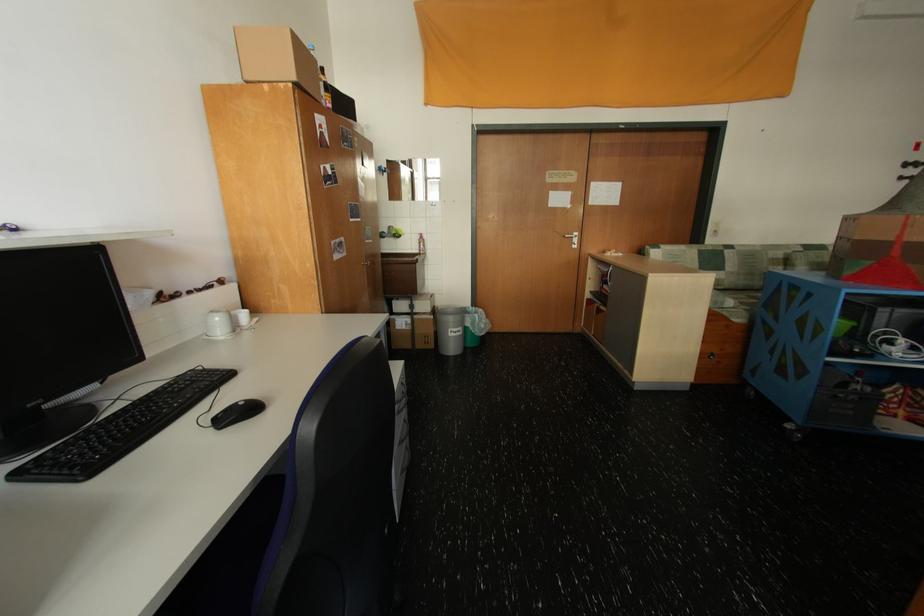
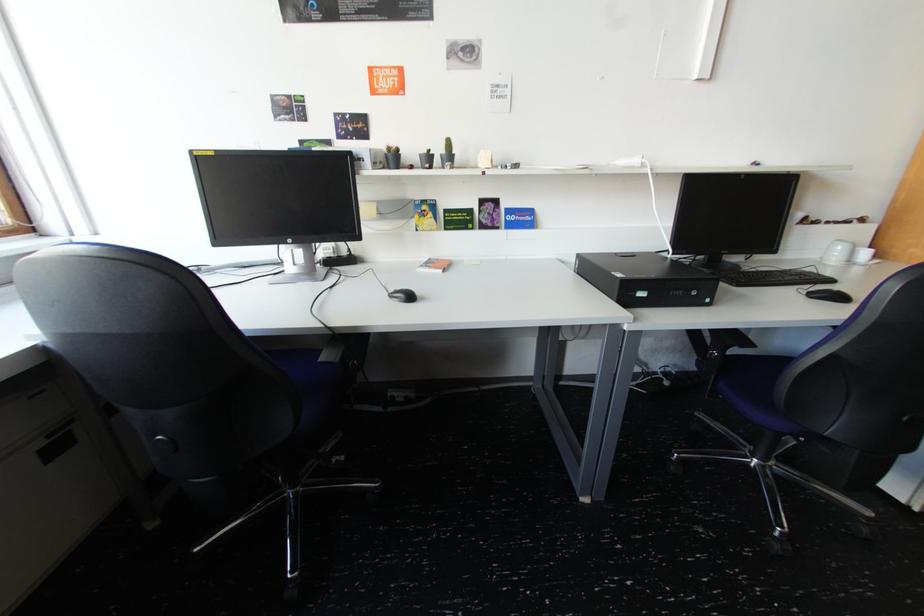
Locate, in the second image, the point that corresponds to pixel 226 320 in the first image.

(849, 249)